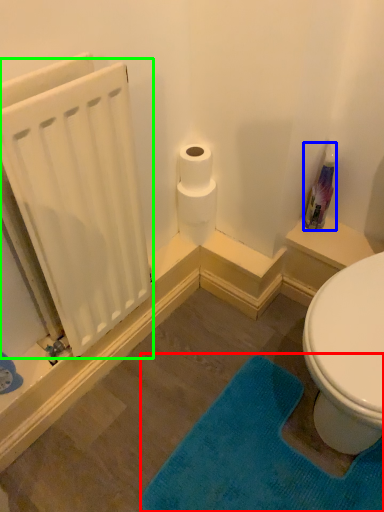
Question: Which object is the closest to the bath mat (highlighted by a red box)? Choose among these: cleaning product (highlighted by a blue box) or radiator (highlighted by a green box).

Choices:
 (A) cleaning product
 (B) radiator

Answer: (B)